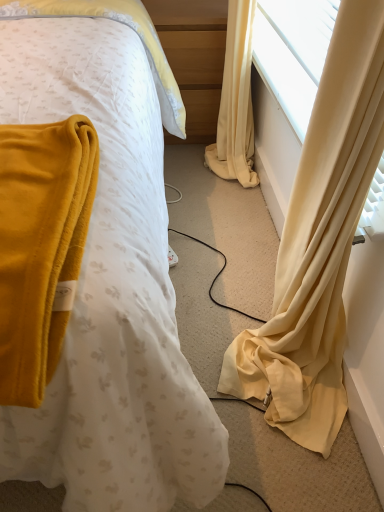
You are a GUI agent. You are given a task and a screenshot of the screen. Output one action in this format:
    pyautogui.click(x=<x>, y=<y>)
    Task: Click on the soft yellow blanket at left
    The image size is (384, 512).
    Given the screenshot: What is the action you would take?
    pyautogui.click(x=61, y=81)

What do you see at coordinates (61, 81) in the screenshot? Image resolution: width=384 pixels, height=512 pixels. I see `soft yellow blanket at left` at bounding box center [61, 81].

You are a GUI agent. You are given a task and a screenshot of the screen. Output one action in this format:
    pyautogui.click(x=<x>, y=<y>)
    Task: Click on the soft yellow blanket at left
    
    Given the screenshot: What is the action you would take?
    pyautogui.click(x=61, y=81)